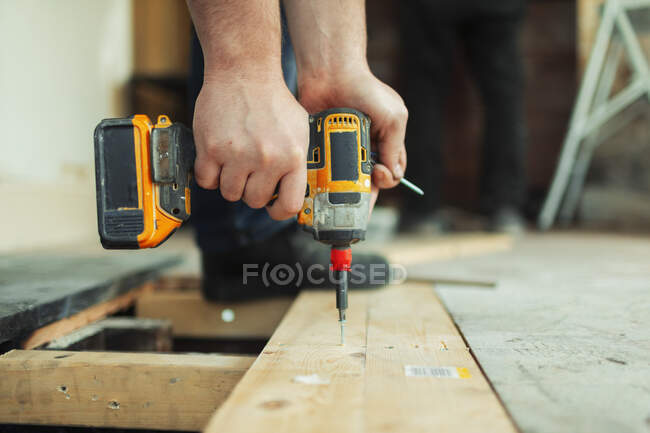
The height and width of the screenshot is (433, 650). I want to click on ladder, so click(595, 127).